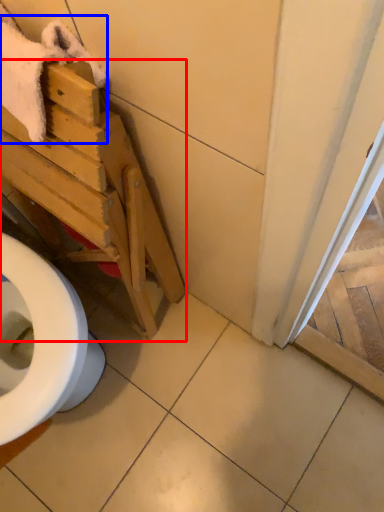
Question: Which object appears farthest to the camera in this image, furniture (highlighted by a red box) or bath towel (highlighted by a blue box)?

Choices:
 (A) furniture
 (B) bath towel

Answer: (B)